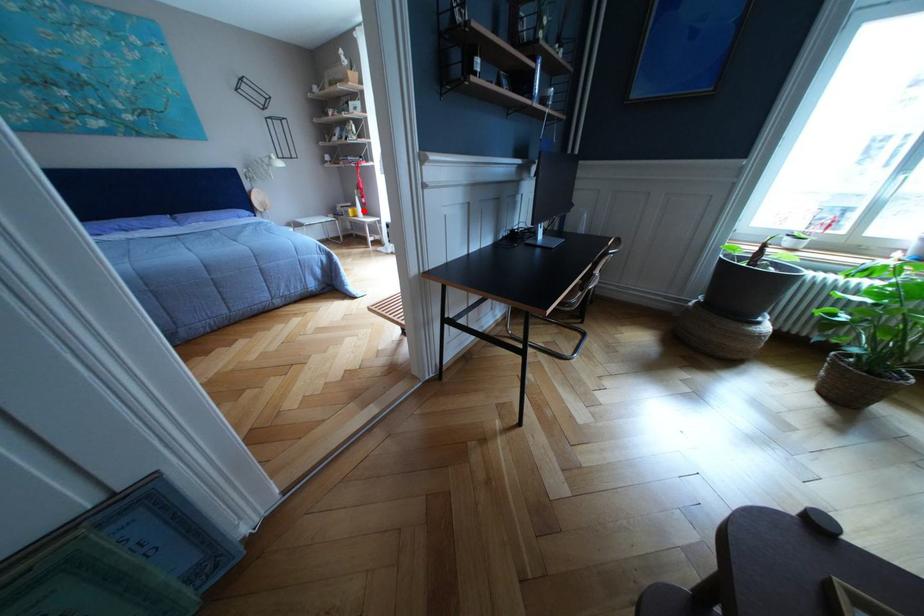
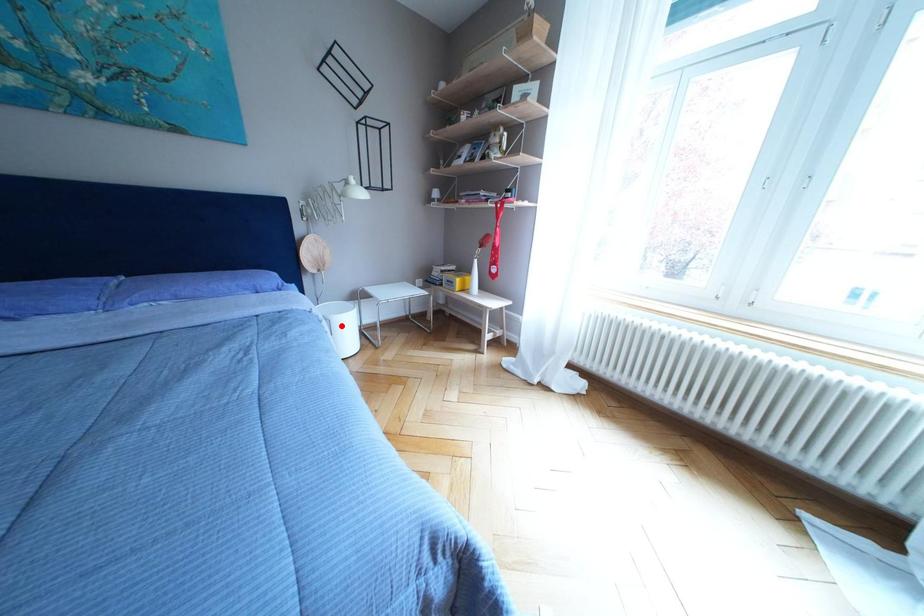
I am providing you with two images of the same scene from different viewpoints. A red point is marked on the first image and another point is marked on the second image. Are the points marked in image1 and image2 representing the same 3D position?

No